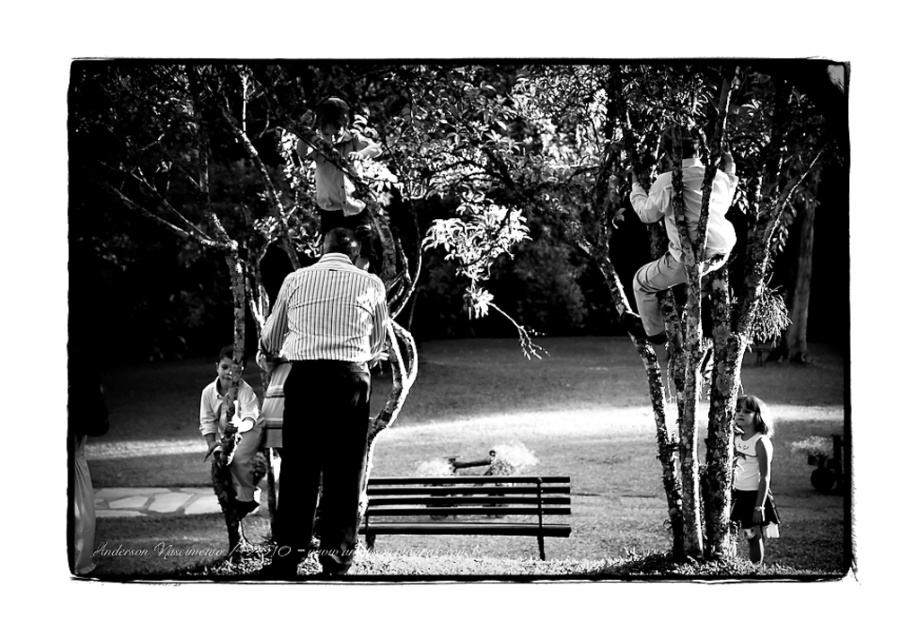
Question: Among these points, which one is nearest to the camera?

Choices:
 (A) (770, 500)
 (B) (360, 134)
 (C) (159, 397)

Answer: (B)

Question: Can you confirm if striped shirt at center is thinner than wooden bench at center?

Choices:
 (A) no
 (B) yes

Answer: (B)

Question: Which point appears farthest from the camera in this image?

Choices:
 (A) (268, 320)
 (B) (321, 468)
 (C) (766, 492)
 (D) (335, 195)

Answer: (D)

Question: Is wooden bench at center to the left of smooth white shirt at upper center from the viewer's perspective?

Choices:
 (A) no
 (B) yes

Answer: (A)

Question: Which object is closer to the camera taking this photo?

Choices:
 (A) striped shirt at center
 (B) smooth skin child at lower left
 (C) smooth white shirt at upper center
 (D) white matte dress at lower right

Answer: (A)

Question: Can you confirm if wooden bench at center is positioned below smooth skin child at lower left?

Choices:
 (A) no
 (B) yes

Answer: (B)